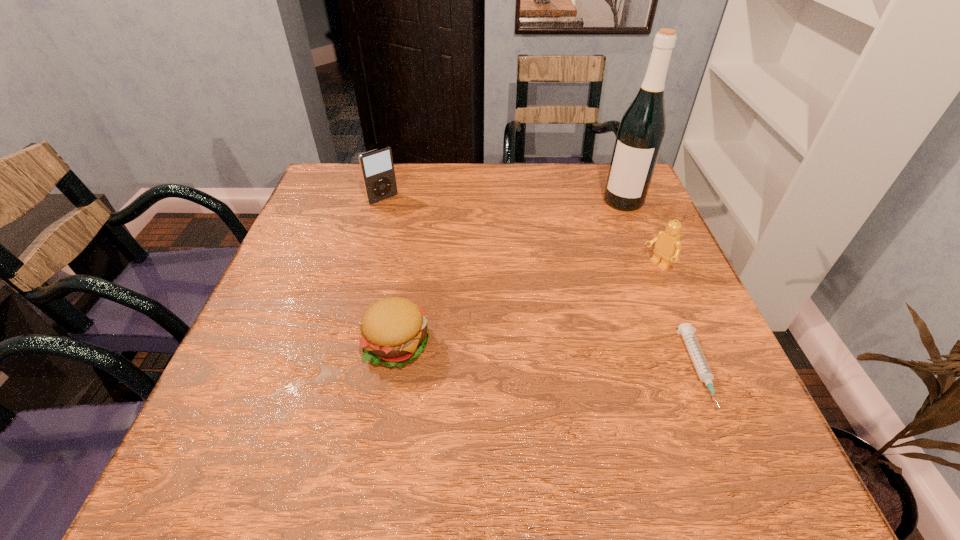
I want to click on vacant region between the hamburger and the syringe, so click(547, 357).

The height and width of the screenshot is (540, 960). Identify the location of unoccupied area between the tallest object and the iPod. (503, 200).

At what (x,y) coordinates should I click in order to perform the action: click on the closest object to the iPod. Please return your answer as a coordinate pair (x, y). Looking at the image, I should click on (394, 331).

Where is `the closest object to the shortest object`? the closest object to the shortest object is located at coordinates pyautogui.click(x=668, y=245).

Locate an element on the screen. vacant space that satisfies the following two spatial constraints: 1. on the front side of the Lego; 2. on the left side of the wine bottle is located at coordinates (650, 266).